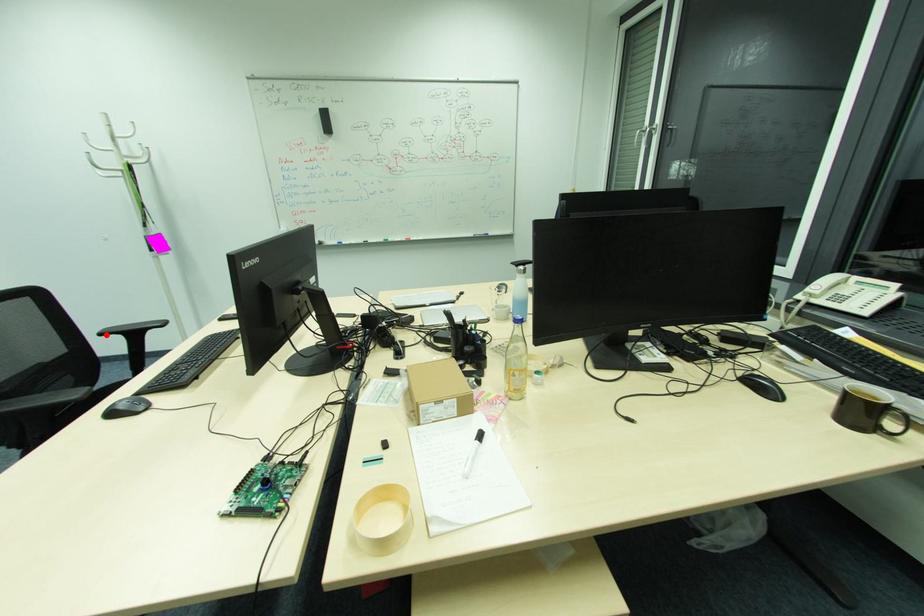
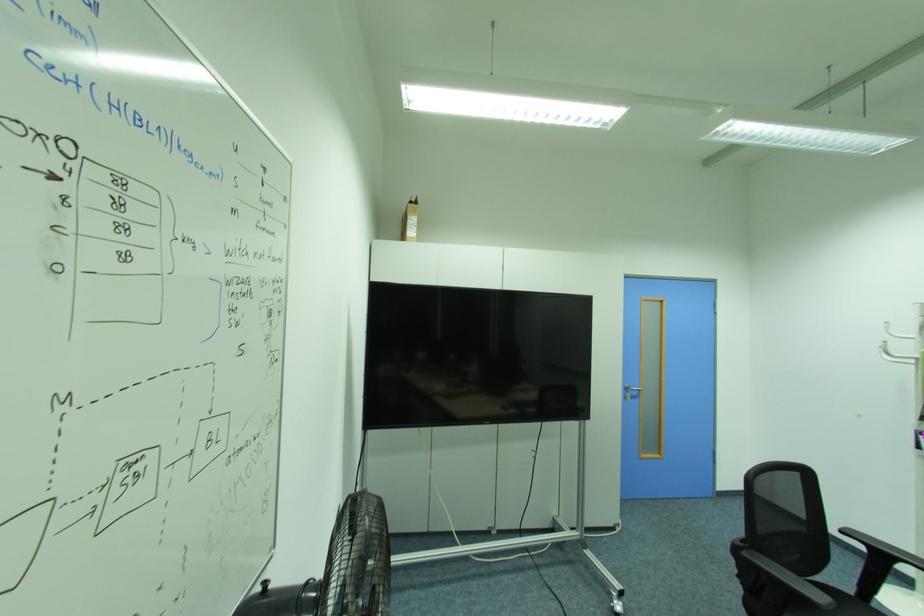
Locate, in the second image, the point that corresponds to the highlighted location in the first image.

(846, 532)